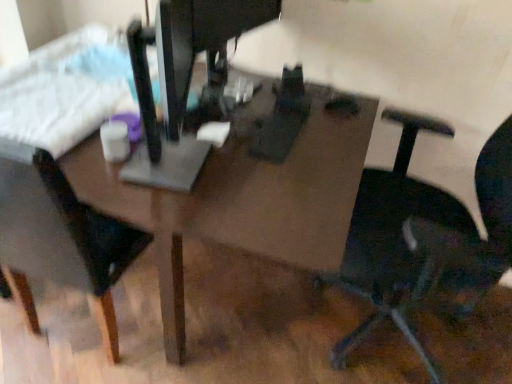
In order to click on vacant space underneath black plastic chair at right, which is the 1th chair from right to left (from a real-world perspective) in this screenshot , I will do `click(387, 339)`.